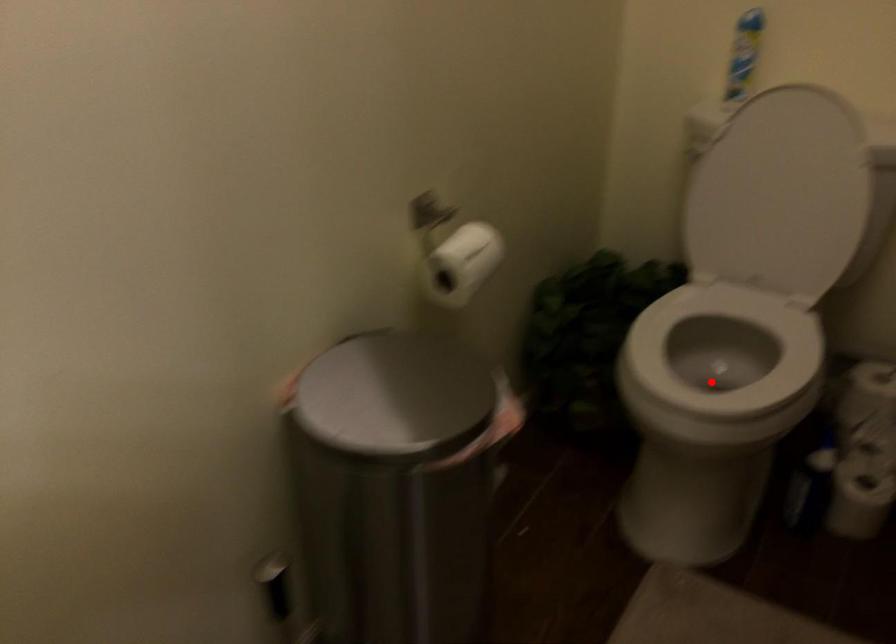
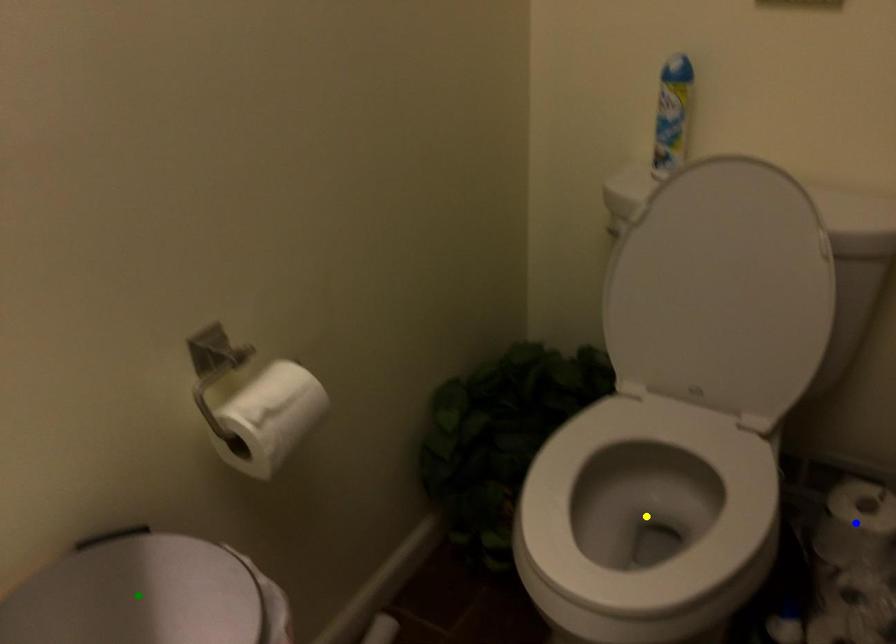
Question: I am providing you with two images of the same scene from different viewpoints. A red point is marked on the first image. You are given multiple points on the second image. Which spot in image 2 lines up with the point in image 1?

Choices:
 (A) blue point
 (B) yellow point
 (C) green point

Answer: (B)